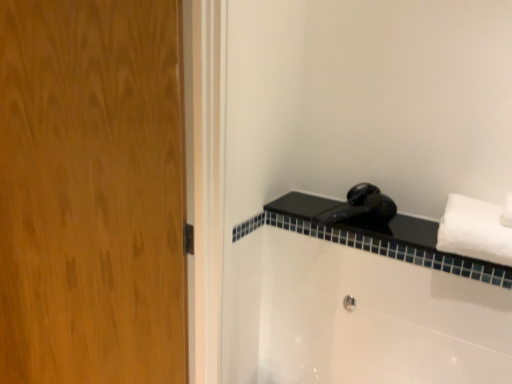
Question: From the image's perspective, is wooden door at left on top of white fluffy towel at right?

Choices:
 (A) yes
 (B) no

Answer: (B)

Question: Is wooden door at left bigger than white fluffy towel at right?

Choices:
 (A) no
 (B) yes

Answer: (B)

Question: Is wooden door at left turned away from white fluffy towel at right?

Choices:
 (A) yes
 (B) no

Answer: (B)

Question: From a real-world perspective, is wooden door at left below white fluffy towel at right?

Choices:
 (A) yes
 (B) no

Answer: (A)

Question: From a real-world perspective, is wooden door at left located higher than white fluffy towel at right?

Choices:
 (A) yes
 (B) no

Answer: (B)

Question: In terms of height, does black matte faucet at upper right look taller or shorter compared to white fluffy towel at right?

Choices:
 (A) tall
 (B) short

Answer: (B)

Question: Looking at their shapes, would you say black matte faucet at upper right is wider or thinner than white fluffy towel at right?

Choices:
 (A) wide
 (B) thin

Answer: (A)

Question: Based on their positions, is black matte faucet at upper right located to the left or right of white fluffy towel at right?

Choices:
 (A) right
 (B) left

Answer: (B)

Question: Would you say black matte faucet at upper right is inside or outside white fluffy towel at right?

Choices:
 (A) inside
 (B) outside

Answer: (B)

Question: Is metallic silver showerhead at lower center bigger or smaller than wooden door at left?

Choices:
 (A) big
 (B) small

Answer: (B)

Question: From their relative heights in the image, would you say metallic silver showerhead at lower center is taller or shorter than wooden door at left?

Choices:
 (A) tall
 (B) short

Answer: (B)

Question: Looking at their shapes, would you say metallic silver showerhead at lower center is wider or thinner than wooden door at left?

Choices:
 (A) thin
 (B) wide

Answer: (A)

Question: Would you say metallic silver showerhead at lower center is inside or outside wooden door at left?

Choices:
 (A) outside
 (B) inside

Answer: (A)

Question: In the image, is white fluffy towel at right on the left side or the right side of black matte faucet at upper right?

Choices:
 (A) left
 (B) right

Answer: (B)

Question: Considering the positions of white fluffy towel at right and black matte faucet at upper right in the image, is white fluffy towel at right taller or shorter than black matte faucet at upper right?

Choices:
 (A) short
 (B) tall

Answer: (B)